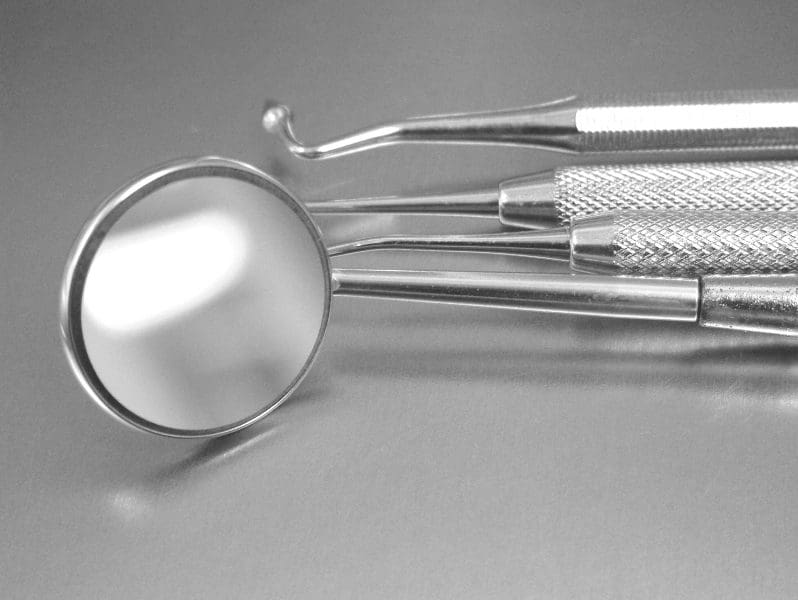
Image resolution: width=798 pixels, height=600 pixels. What are the coordinates of `tray` in the screenshot? It's located at (413, 474).